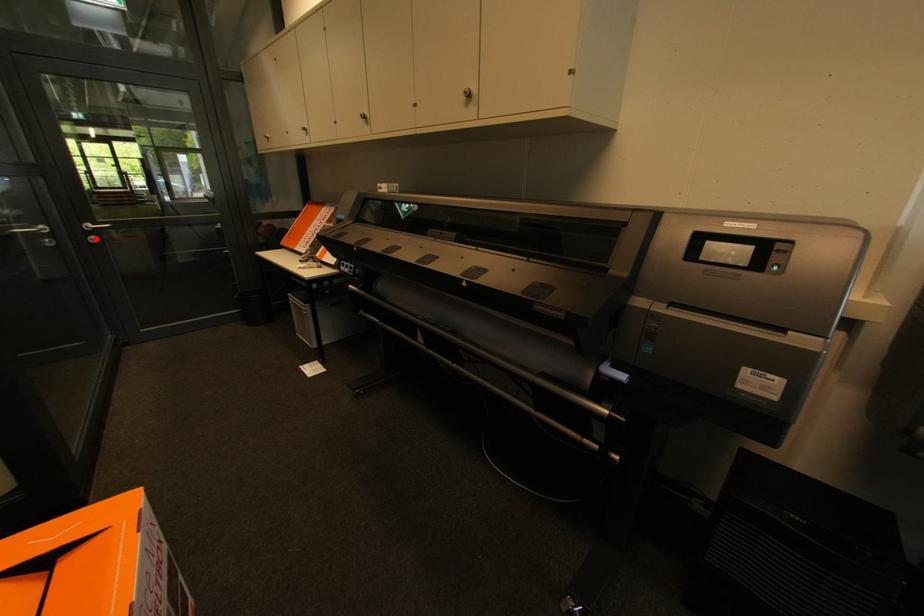
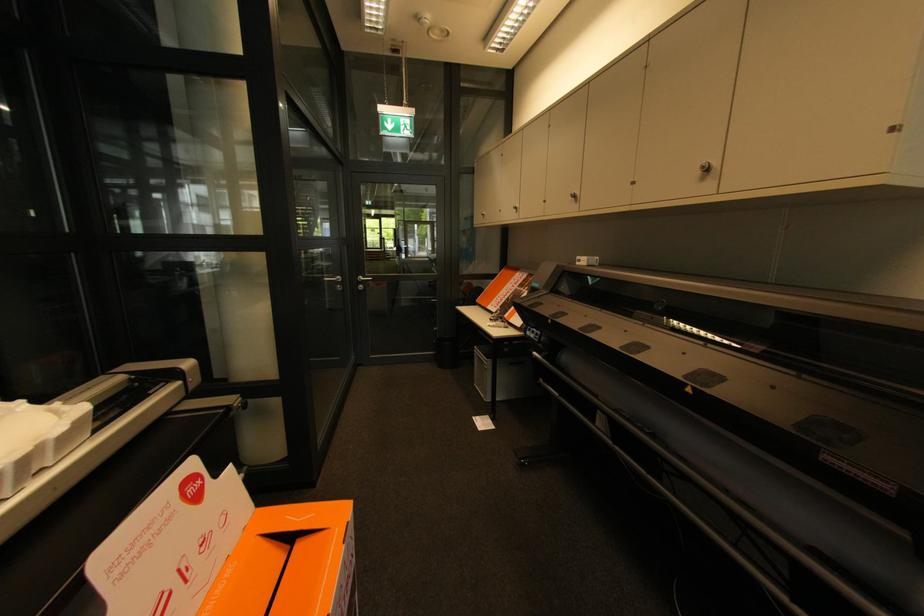
Question: I am providing you with two images of the same scene from different viewpoints. A red point is shown in image1. For the corresponding object point in image2, is it positioned nearer or farther from the camera?

Choices:
 (A) Nearer
 (B) Farther

Answer: (A)